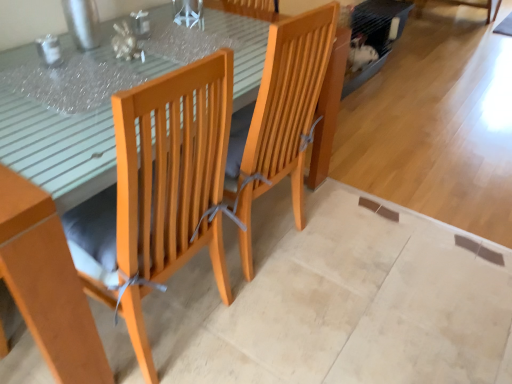
This screenshot has height=384, width=512. Identify the location of wooden table at center. (58, 149).

What do you see at coordinates (58, 149) in the screenshot? Image resolution: width=512 pixels, height=384 pixels. I see `wooden table at center` at bounding box center [58, 149].

You are a GUI agent. You are given a task and a screenshot of the screen. Output one action in this format:
    pyautogui.click(x=<x>, y=<y>)
    Task: Click on the wooden chair at center
    This screenshot has height=384, width=512.
    Given the screenshot: What is the action you would take?
    pyautogui.click(x=284, y=115)

What do you see at coordinates (284, 115) in the screenshot?
I see `wooden chair at center` at bounding box center [284, 115].

Where is `wooden table at center`? The height and width of the screenshot is (384, 512). wooden table at center is located at coordinates (58, 149).

Between wooden chair at center and wooden table at center, which one appears on the left side from the viewer's perspective?

wooden table at center is more to the left.

Is wooden chair at center positioned behind wooden table at center?

That is True.

Does point (315, 74) appear closer or farther from the camera than point (84, 183)?

Point (315, 74) is positioned farther from the camera compared to point (84, 183).

From the image's perspective, which is below, wooden chair at center or wooden table at center?

wooden table at center appears lower in the image.

From a real-world perspective, is wooden chair at center physically located above or below wooden table at center?

In terms of real-world spatial position, wooden chair at center is above wooden table at center.

Does wooden chair at center have a greater width compared to wooden table at center?

No.

Based on the photo, does wooden chair at center have a lesser height compared to wooden table at center?

No.

Who is bigger, wooden chair at center or wooden table at center?

Bigger between the two is wooden table at center.

Is wooden chair at center not within wooden table at center?

No, wooden chair at center is inside or overlapping with wooden table at center.

Would you consider wooden chair at center to be distant from wooden table at center?

That's not correct — wooden chair at center is a little close to wooden table at center.

Is wooden chair at center facing towards wooden table at center?

Yes.

How far apart are wooden chair at center and wooden table at center?

wooden chair at center and wooden table at center are 24.47 inches apart.

Identify the location of chair on the right of wooden table at center. (284, 115).

Between wooden table at center and wooden chair at center, which one appears on the right side from the viewer's perspective?

wooden chair at center is more to the right.

Is wooden table at center closer to camera compared to wooden chair at center?

Yes.

Which is behind, point (326, 167) or point (325, 55)?

The point (326, 167) is farther from the camera.

From the image's perspective, is wooden table at center positioned above or below wooden chair at center?

wooden table at center is situated lower than wooden chair at center in the image.

From a real-world perspective, which is physically above, wooden table at center or wooden chair at center?

wooden chair at center.

Is wooden table at center thinner than wooden chair at center?

No.

Based on the photo, who is taller, wooden table at center or wooden chair at center?

wooden chair at center.

Can you confirm if wooden table at center is bigger than wooden chair at center?

Yes.

Can wooden chair at center be found inside wooden table at center?

Yes, wooden table at center contains wooden chair at center.

Is wooden table at center beside wooden chair at center?

No, wooden table at center is not with wooden chair at center.

Could you tell me if wooden table at center is facing wooden chair at center?

Yes, wooden table at center is oriented towards wooden chair at center.

What's the angular difference between wooden table at center and wooden chair at center's facing directions?

180 degrees.

The height and width of the screenshot is (384, 512). Identify the location of table below the wooden chair at center (from the image's perspective). (58, 149).

This screenshot has width=512, height=384. In order to click on table below the wooden chair at center (from the image's perspective) in this screenshot , I will do `click(58, 149)`.

The image size is (512, 384). In order to click on chair located on the right of wooden table at center in this screenshot , I will do `click(284, 115)`.